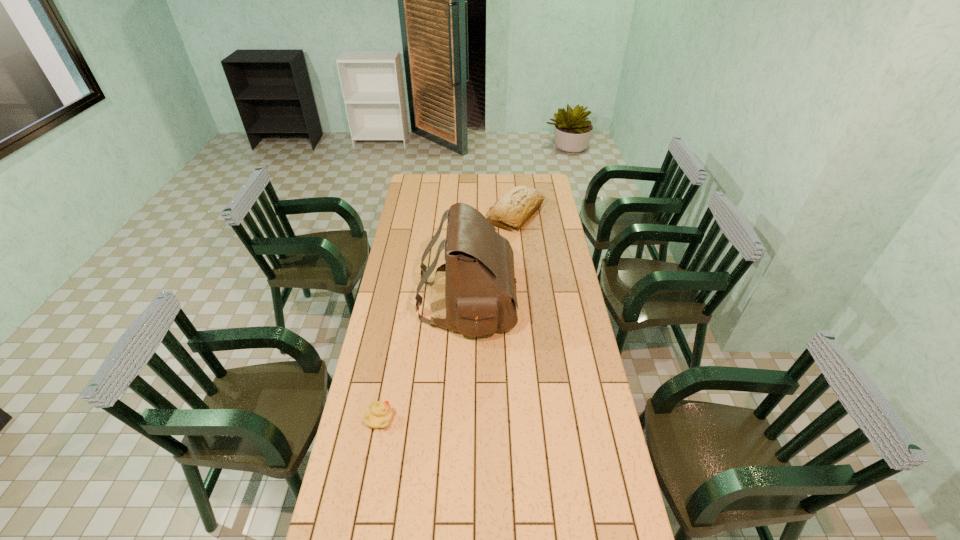
You are a GUI agent. You are given a task and a screenshot of the screen. Output one action in this format:
    pyautogui.click(x=<x>, y=<y>)
    Task: Click on the tallest object
    The image size is (960, 540).
    Given the screenshot: What is the action you would take?
    pyautogui.click(x=480, y=293)

Find the location of a particular element. This screenshot has width=960, height=540. the second farthest object is located at coordinates (480, 293).

The height and width of the screenshot is (540, 960). Identify the location of bread. (515, 208).

Identify the location of the second tallest object. (515, 208).

The image size is (960, 540). What are the coordinates of `the shortest object` in the screenshot? It's located at (380, 414).

In order to click on the leftmost object in this screenshot , I will do `click(380, 414)`.

At what (x,y) coordinates should I click in order to perform the action: click on vacant area situated on the front flap of the tallest object. Please return your answer as a coordinate pair (x, y). Looking at the image, I should click on (565, 303).

The height and width of the screenshot is (540, 960). Identify the location of free space located on the left of the farthest object. (448, 214).

Where is `vacant space positioned 0.100m on the front-facing side of the duckling`? vacant space positioned 0.100m on the front-facing side of the duckling is located at coordinates (422, 418).

Image resolution: width=960 pixels, height=540 pixels. I want to click on object present at the left edge, so pyautogui.click(x=380, y=414).